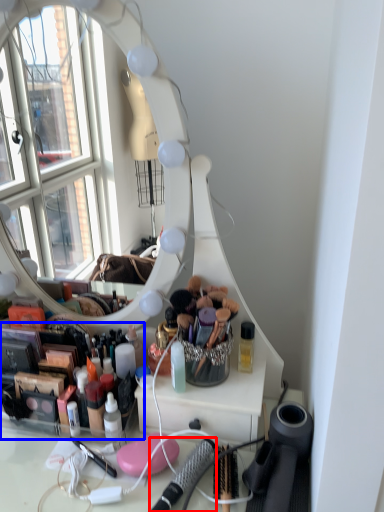
Question: Which of the following is the farthest to the observer, brush (highlighted by a red box) or toiletry (highlighted by a blue box)?

Choices:
 (A) brush
 (B) toiletry

Answer: (B)